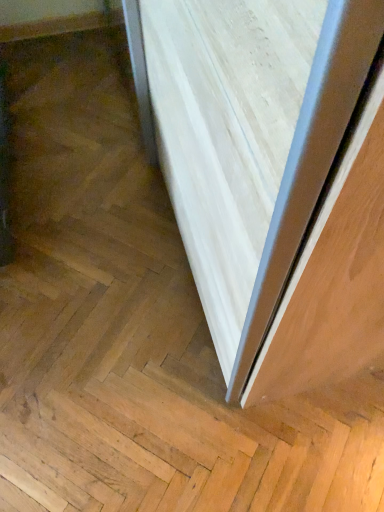
Question: Should I look upward or downward to see white wood door at center?

Choices:
 (A) down
 (B) up

Answer: (B)